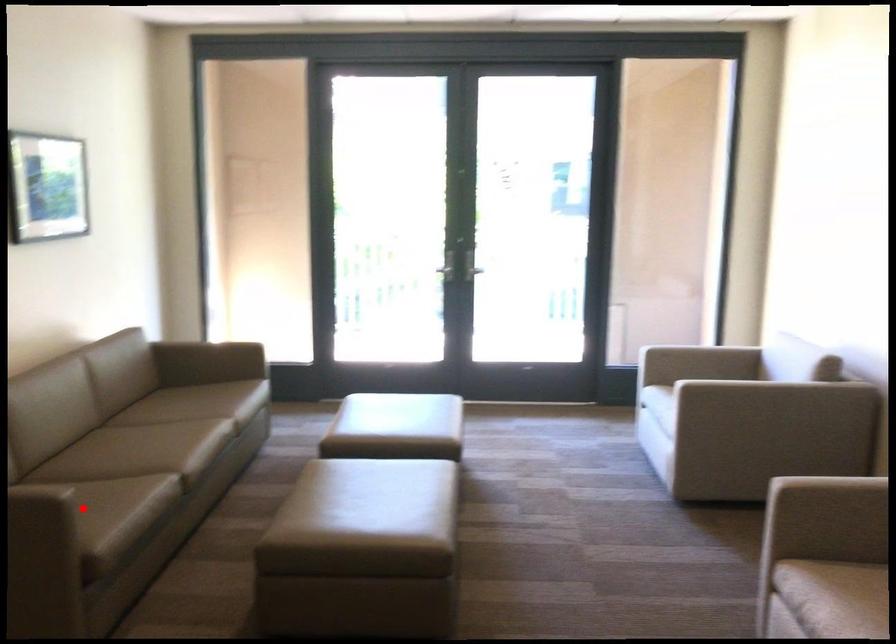
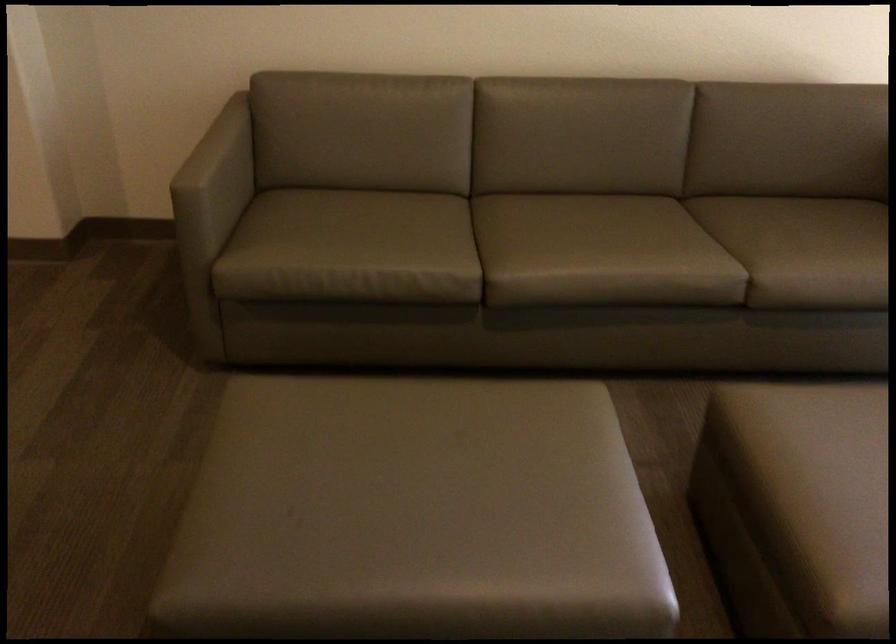
Question: I am providing you with two images of the same scene from different viewpoints. A red point is shown in image1. For the corresponding object point in image2, is it positioned nearer or farther from the camera?

Choices:
 (A) Nearer
 (B) Farther

Answer: (A)